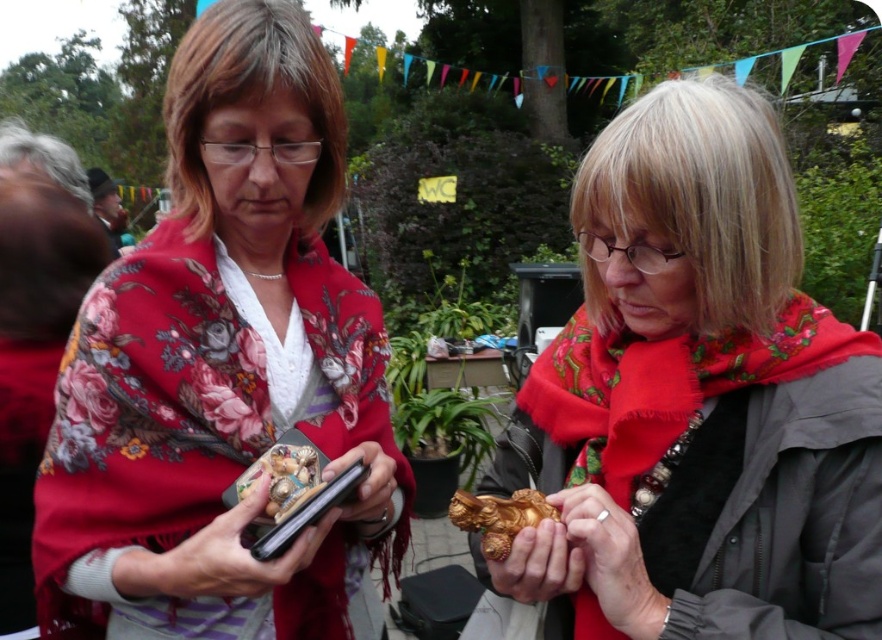
What is the object located at the coordinates point (x=701, y=394)?

The object located at point (x=701, y=394) is the gold metallic statue at center.

You are a photographer trying to capture a closeup of the gold metallic ornament at center without the floral scarf at center appearing in the frame. Based on their positions, is this possible?

The floral scarf at center is to the left of the gold metallic ornament at center, so if you position the camera to focus solely on the gold metallic ornament at center while avoiding the left side of the frame, it should be possible to exclude the floral scarf at center from the shot.